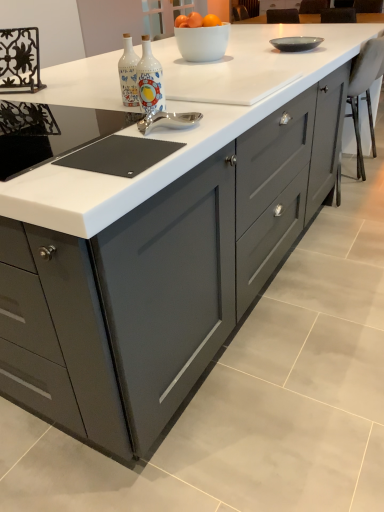
Question: Is matte gray bowl at upper right at the back of decorative ceramic bottles at center?

Choices:
 (A) no
 (B) yes

Answer: (A)

Question: Is decorative ceramic bottles at center taller than matte gray bowl at upper right?

Choices:
 (A) yes
 (B) no

Answer: (A)

Question: Does decorative ceramic bottles at center turn towards matte gray bowl at upper right?

Choices:
 (A) no
 (B) yes

Answer: (B)

Question: Is decorative ceramic bottles at center not close to matte gray bowl at upper right?

Choices:
 (A) yes
 (B) no

Answer: (B)

Question: Is matte gray bowl at upper right a part of decorative ceramic bottles at center?

Choices:
 (A) yes
 (B) no

Answer: (B)

Question: Based on their positions, is black glass gas stove at center located to the left or right of decorative ceramic bottles at center?

Choices:
 (A) right
 (B) left

Answer: (B)

Question: From the image's perspective, is black glass gas stove at center positioned above or below decorative ceramic bottles at center?

Choices:
 (A) above
 (B) below

Answer: (B)

Question: Considering the positions of point (54, 143) and point (150, 53), is point (54, 143) closer or farther from the camera than point (150, 53)?

Choices:
 (A) closer
 (B) farther

Answer: (A)

Question: In terms of width, does black glass gas stove at center look wider or thinner when compared to decorative ceramic bottles at center?

Choices:
 (A) thin
 (B) wide

Answer: (B)

Question: Considering the relative positions of orange matte at upper center and white fabric chair at right in the image provided, is orange matte at upper center to the left or to the right of white fabric chair at right?

Choices:
 (A) right
 (B) left

Answer: (B)

Question: Looking at their shapes, would you say orange matte at upper center is wider or thinner than white fabric chair at right?

Choices:
 (A) thin
 (B) wide

Answer: (A)

Question: Is orange matte at upper center bigger or smaller than white fabric chair at right?

Choices:
 (A) small
 (B) big

Answer: (A)

Question: From a real-world perspective, is orange matte at upper center positioned above or below white fabric chair at right?

Choices:
 (A) below
 (B) above

Answer: (B)

Question: Is black glass gas stove at center taller or shorter than matte gray bowl at upper right?

Choices:
 (A) tall
 (B) short

Answer: (B)

Question: Looking at the image, does black glass gas stove at center seem bigger or smaller compared to matte gray bowl at upper right?

Choices:
 (A) small
 (B) big

Answer: (B)